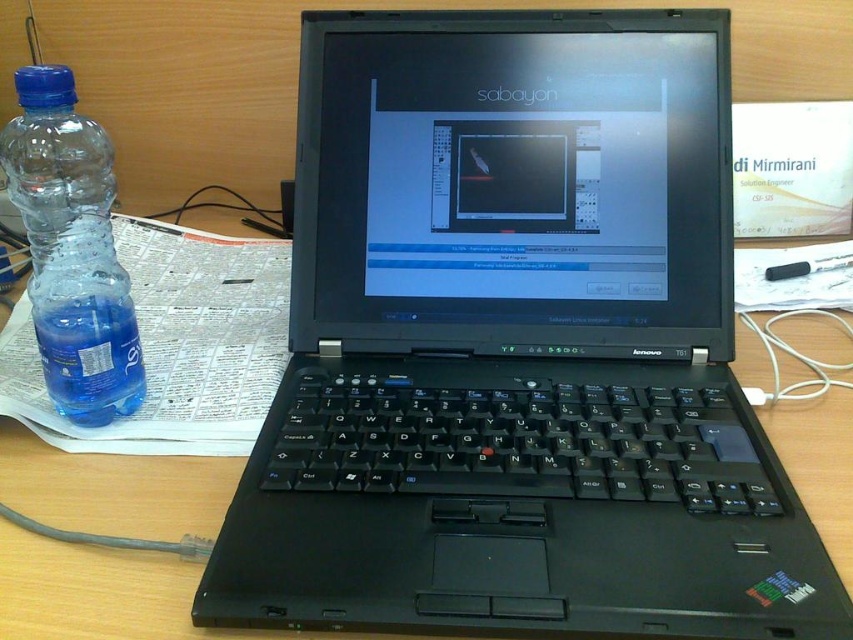
Question: Among these objects, which one is farthest from the camera?

Choices:
 (A) transparent plastic bottle at left
 (B) transparent plastic water at bottle left

Answer: (B)

Question: Which point is farther from the camera taking this photo?

Choices:
 (A) (79, 403)
 (B) (136, 355)

Answer: (B)

Question: Does transparent plastic bottle at left have a smaller size compared to transparent plastic water at bottle left?

Choices:
 (A) no
 (B) yes

Answer: (A)

Question: Is transparent plastic bottle at left thinner than transparent plastic water at bottle left?

Choices:
 (A) no
 (B) yes

Answer: (A)

Question: Is transparent plastic bottle at left wider than transparent plastic water at bottle left?

Choices:
 (A) no
 (B) yes

Answer: (B)

Question: Which point appears closest to the camera in this image?

Choices:
 (A) (90, 356)
 (B) (16, 99)

Answer: (A)